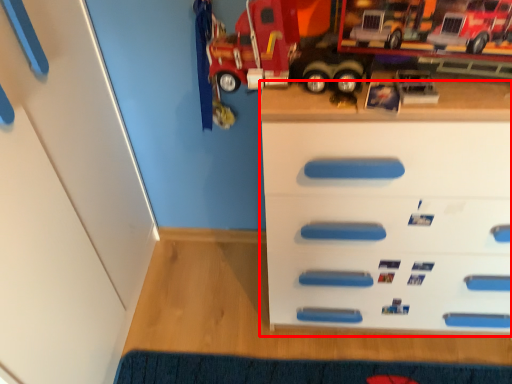
Question: From the image's perspective, where is chest of drawers (annotated by the red box) located relative to doormat?

Choices:
 (A) above
 (B) below

Answer: (A)